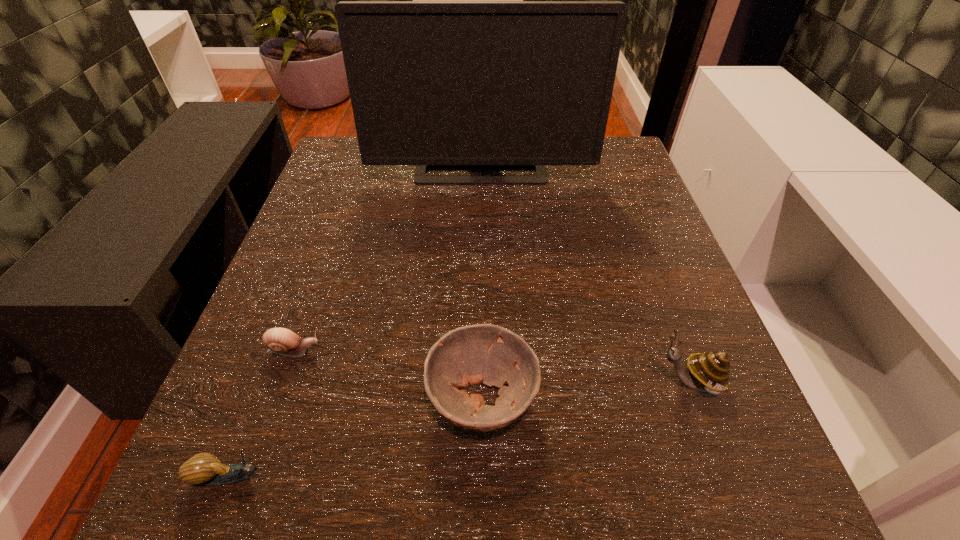
Image resolution: width=960 pixels, height=540 pixels. I want to click on free region located 0.270m on the face of the fourth shortest object, so click(x=458, y=382).

Identify the location of free space located on the left of the bowl. The width and height of the screenshot is (960, 540). (297, 399).

The image size is (960, 540). Find the location of `vacant space located 0.050m on the front-facing side of the nearest escargot`. vacant space located 0.050m on the front-facing side of the nearest escargot is located at coordinates (309, 476).

This screenshot has height=540, width=960. Identify the location of vacant region located on the front-facing side of the farthest escargot. (368, 350).

I want to click on object that is at the far edge, so click(438, 84).

I want to click on bowl at the near edge, so click(x=483, y=353).

The width and height of the screenshot is (960, 540). Find the location of `escargot located in the near edge section of the desktop`. escargot located in the near edge section of the desktop is located at coordinates (204, 468).

Where is `computer monitor positioned at the left edge`? This screenshot has height=540, width=960. computer monitor positioned at the left edge is located at coordinates (438, 84).

Where is `computer monitor positioned at the right edge`? The image size is (960, 540). computer monitor positioned at the right edge is located at coordinates (438, 84).

You are a GUI agent. You are given a task and a screenshot of the screen. Output one action in this format:
    pyautogui.click(x=<x>, y=<y>)
    Task: Click on the snail at the right edge
    The image size is (960, 540).
    Given the screenshot: What is the action you would take?
    pos(710,371)